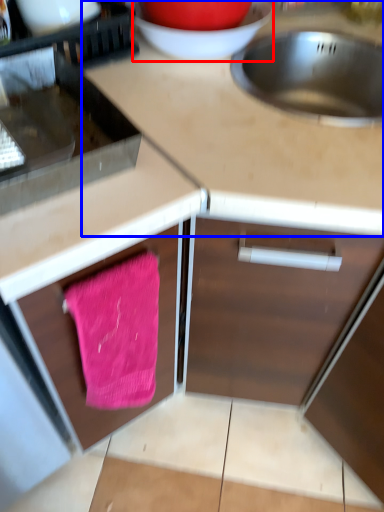
Question: Which point is closer to the camera, basin (highlighted by a red box) or countertop (highlighted by a blue box)?

Choices:
 (A) basin
 (B) countertop

Answer: (B)